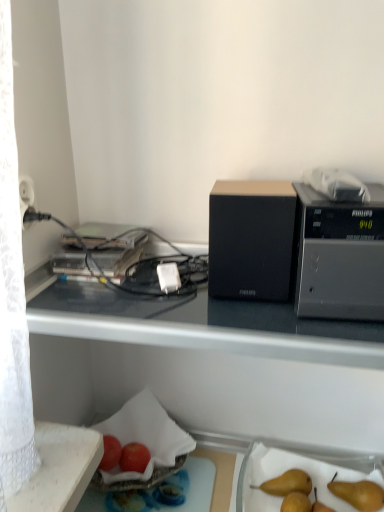
Locate an element on the screen. free location above black plastic microwave at upper right, the first appliance positioned from the right (from a real-world perspective) is located at coordinates (349, 196).